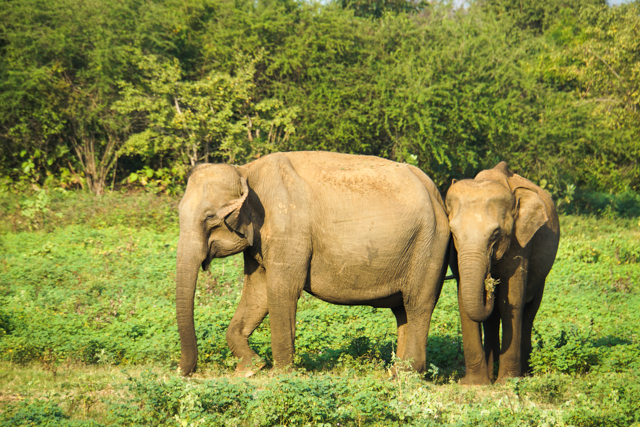
This screenshot has height=427, width=640. I want to click on left front leg, so click(271, 338).